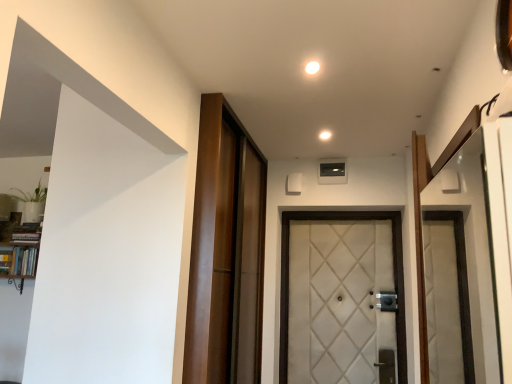
Question: From a real-world perspective, does wooden barn door at center stand above white glossy light at upper center, which is the 1th light in left-to-right order?

Choices:
 (A) no
 (B) yes

Answer: (A)

Question: Considering the relative sizes of wooden barn door at center and white glossy light at upper center, arranged as the first light when viewed from the front, in the image provided, is wooden barn door at center bigger than white glossy light at upper center, arranged as the first light when viewed from the front,?

Choices:
 (A) no
 (B) yes

Answer: (B)

Question: Is wooden barn door at center taller than white glossy light at upper center, the 2th light ordered from the bottom?

Choices:
 (A) yes
 (B) no

Answer: (A)

Question: Is wooden barn door at center positioned in front of white glossy light at upper center, which is the 2th light from right to left?

Choices:
 (A) yes
 (B) no

Answer: (B)

Question: Does wooden barn door at center have a lesser height compared to white glossy light at upper center, placed as the 2th light when sorted from back to front?

Choices:
 (A) yes
 (B) no

Answer: (B)

Question: Choose the correct answer: Is white quilted fabric door at center inside white glossy light at upper center, placed as the 2th light when sorted from back to front, or outside it?

Choices:
 (A) inside
 (B) outside

Answer: (B)

Question: Would you say white quilted fabric door at center is to the left or to the right of white glossy light at upper center, the 2th light ordered from the bottom, in the picture?

Choices:
 (A) right
 (B) left

Answer: (A)

Question: In terms of width, does white quilted fabric door at center look wider or thinner when compared to white glossy light at upper center, the first light positioned from the top?

Choices:
 (A) wide
 (B) thin

Answer: (A)

Question: From the image's perspective, is white quilted fabric door at center above or below white glossy light at upper center, which is the 1th light in left-to-right order?

Choices:
 (A) above
 (B) below

Answer: (B)

Question: In the image, is wooden bookshelf at left on the left side or the right side of white glossy light at upper center, the 2th light ordered from the bottom?

Choices:
 (A) right
 (B) left

Answer: (B)

Question: From a real-world perspective, is wooden bookshelf at left physically located above or below white glossy light at upper center, placed as the 2th light when sorted from back to front?

Choices:
 (A) above
 (B) below

Answer: (B)

Question: From the image's perspective, relative to white glossy light at upper center, placed as the 2th light when sorted from back to front, is wooden bookshelf at left above or below?

Choices:
 (A) above
 (B) below

Answer: (B)

Question: Based on their sizes in the image, would you say wooden bookshelf at left is bigger or smaller than white glossy light at upper center, which is the 2th light from right to left?

Choices:
 (A) big
 (B) small

Answer: (A)

Question: From the image's perspective, relative to wooden bookshelf at left, is wooden barn door at center above or below?

Choices:
 (A) above
 (B) below

Answer: (A)

Question: From a real-world perspective, is wooden barn door at center positioned above or below wooden bookshelf at left?

Choices:
 (A) below
 (B) above

Answer: (B)